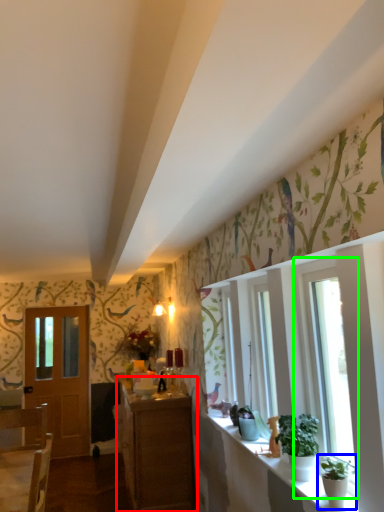
Question: Which object is the closest to the cabinetry (highlighted by a red box)? Choose among these: houseplant (highlighted by a blue box) or window (highlighted by a green box).

Choices:
 (A) houseplant
 (B) window

Answer: (B)